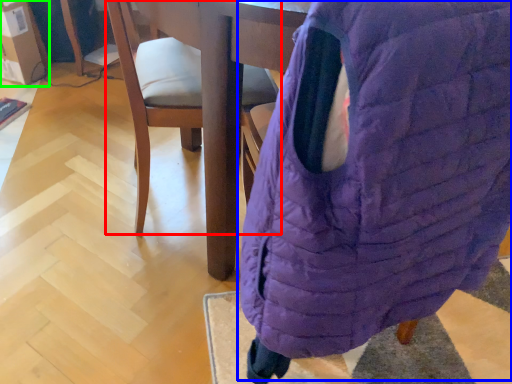
Question: Which object is the closest to the chair (highlighted by a red box)? Choose among these: bean bag chair (highlighted by a blue box) or cardboard box (highlighted by a green box).

Choices:
 (A) bean bag chair
 (B) cardboard box

Answer: (A)